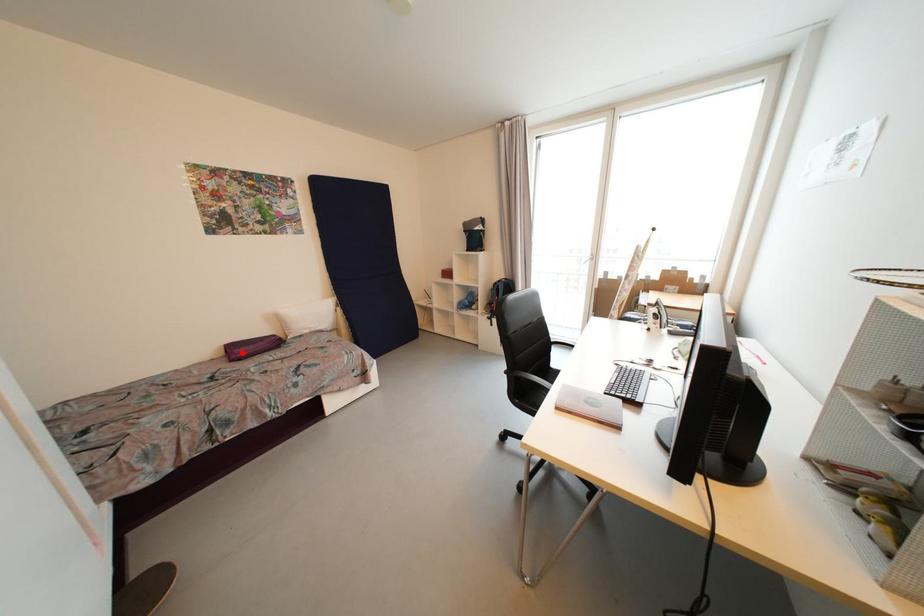
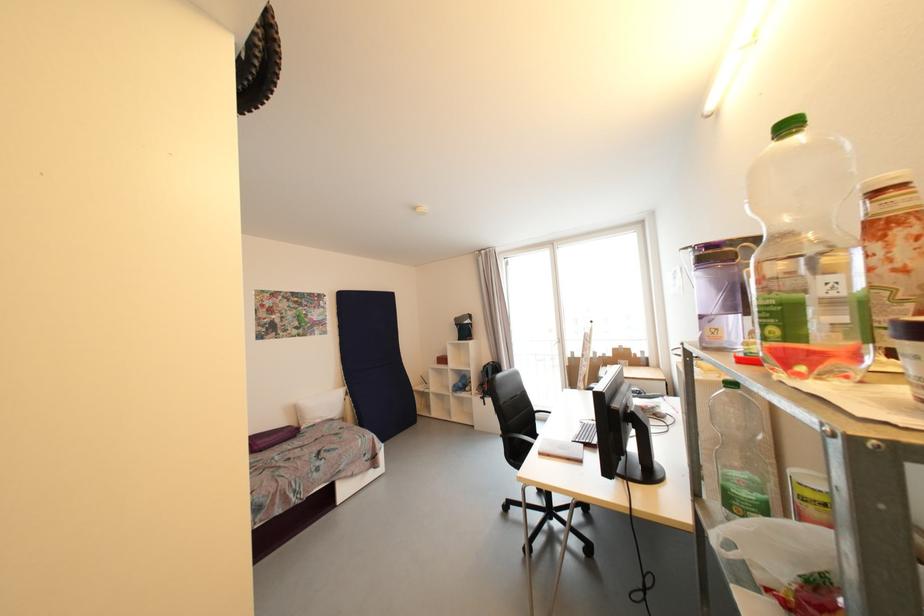
The point at the highlighted location is marked in the first image. Where is the corresponding point in the second image?

(263, 445)